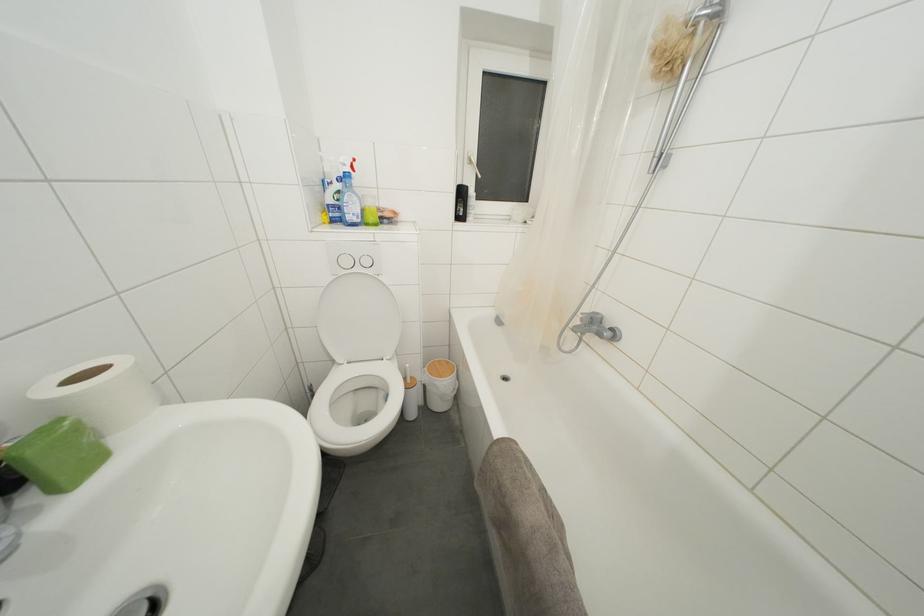
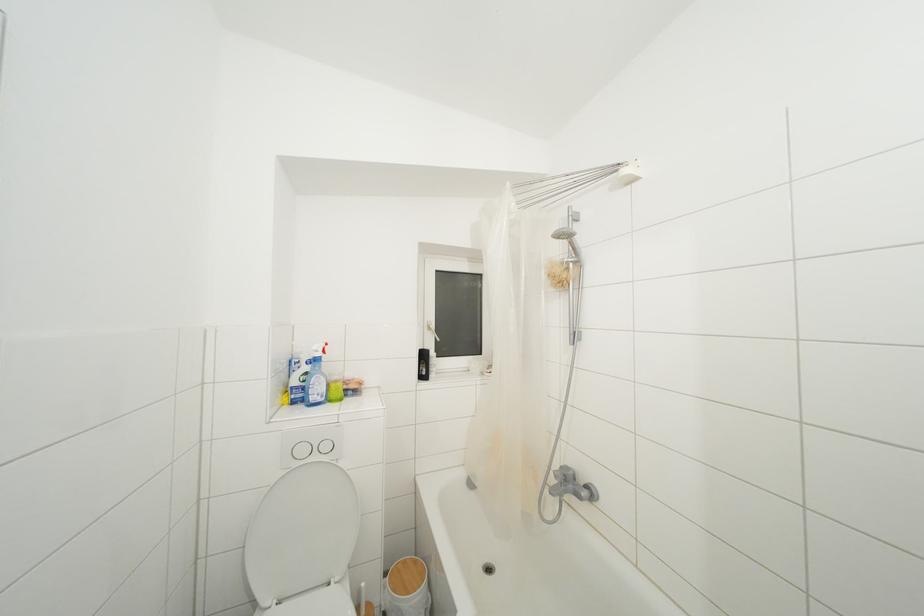
In the second image, find the point that corresponds to pixel 444 366 in the first image.

(408, 567)